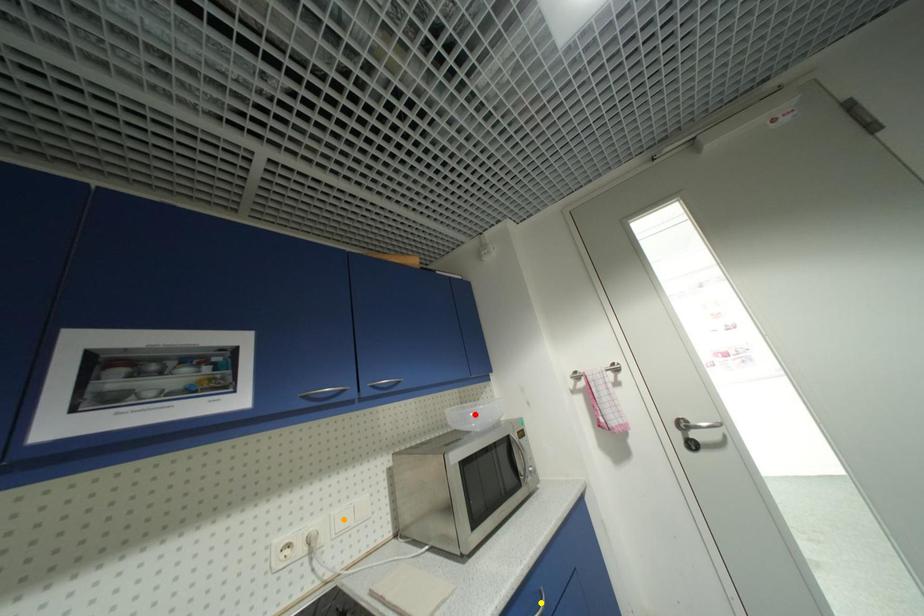
Order these from nearest to farthest:
A) yellow point
B) orange point
C) red point

red point → orange point → yellow point